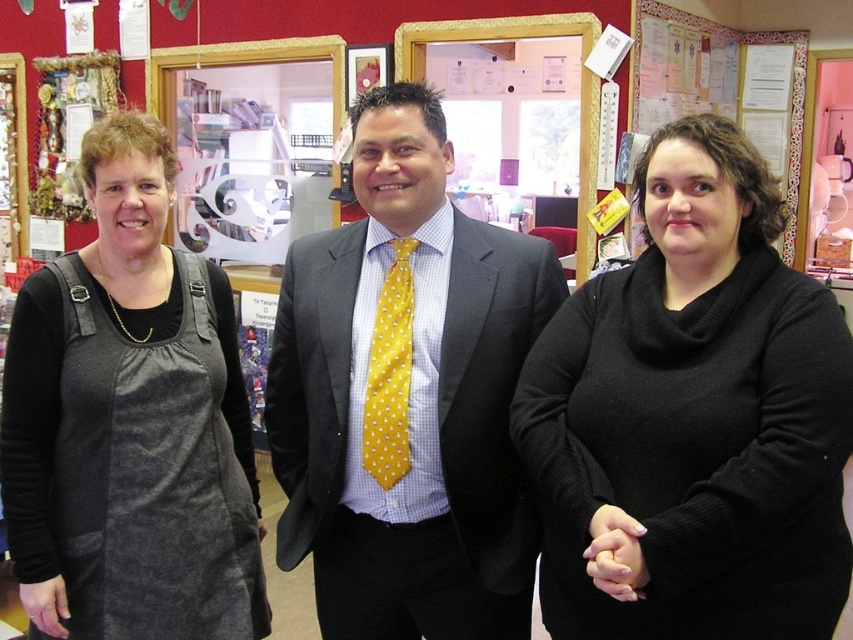
Question: Does yellow dotted tie at center have a greater width compared to brushed metal picture frame at upper center?

Choices:
 (A) yes
 (B) no

Answer: (A)

Question: Can you confirm if black wool sweater at center is positioned to the right of white paperboard at upper right?

Choices:
 (A) yes
 (B) no

Answer: (B)

Question: Which point appears farthest from the camera in this image?

Choices:
 (A) (763, 42)
 (B) (7, 460)
 (C) (363, 92)

Answer: (A)

Question: Which point appears closest to the camera in this image?

Choices:
 (A) (408, 300)
 (B) (91, 637)
 (C) (782, 33)
 (D) (432, 243)

Answer: (A)

Question: Is black wool sweater at center thinner than dark gray fabric apron at left?

Choices:
 (A) yes
 (B) no

Answer: (B)

Question: Which object appears farthest from the camera in this image?

Choices:
 (A) brushed metal picture frame at upper center
 (B) yellow dotted tie at center
 (C) dark gray fabric apron at left

Answer: (A)